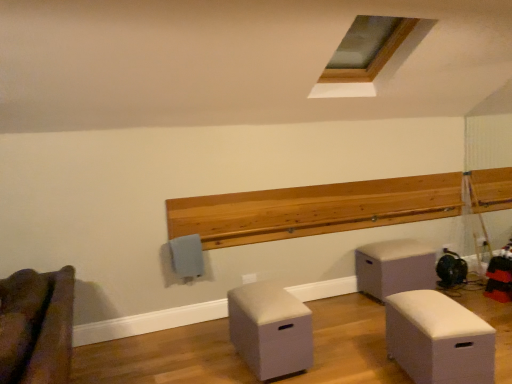
The width and height of the screenshot is (512, 384). What are the coordinates of `beige fabric ottoman at center, which ranks as the third furniture in right-to-left order` in the screenshot? It's located at (270, 330).

The height and width of the screenshot is (384, 512). Find the location of `wooden ledge at upper center`. wooden ledge at upper center is located at coordinates (335, 207).

Image resolution: width=512 pixels, height=384 pixels. Describe the element at coordinates (394, 267) in the screenshot. I see `matte gray ottoman at center right, which is the first furniture from right to left` at that location.

Identify the location of beige fabric ottoman at center, which is the 2th furniture from left to right. The image size is (512, 384). coord(270,330).

From the image's perspective, between white matte storage box at lower right, arranged as the third furniture when viewed from the left, and brown fabric couch at lower left, which appears as the 4th furniture when viewed from the right, which one is located above?

From the image's view, white matte storage box at lower right, arranged as the third furniture when viewed from the left, is above.

From a real-world perspective, who is located higher, white matte storage box at lower right, acting as the second furniture starting from the right, or brown fabric couch at lower left, which appears as the 4th furniture when viewed from the right?

brown fabric couch at lower left, which appears as the 4th furniture when viewed from the right, is physically above.

Is white matte storage box at lower right, arranged as the third furniture when viewed from the left, to the left or to the right of brown fabric couch at lower left, the first furniture when ordered from left to right, in the image?

white matte storage box at lower right, arranged as the third furniture when viewed from the left, is to the right of brown fabric couch at lower left, the first furniture when ordered from left to right.

Which is in front, white matte storage box at lower right, acting as the second furniture starting from the right, or brown fabric couch at lower left, the first furniture when ordered from left to right?

brown fabric couch at lower left, the first furniture when ordered from left to right.

Measure the distance from wooden ledge at upper center to brown fabric couch at lower left, the first furniture when ordered from left to right.

The distance of wooden ledge at upper center from brown fabric couch at lower left, the first furniture when ordered from left to right, is 6.83 feet.

Is wooden ledge at upper center facing towards brown fabric couch at lower left, which appears as the 4th furniture when viewed from the right?

No, wooden ledge at upper center does not turn towards brown fabric couch at lower left, which appears as the 4th furniture when viewed from the right.

Considering the relative sizes of wooden ledge at upper center and brown fabric couch at lower left, which appears as the 4th furniture when viewed from the right, in the image provided, is wooden ledge at upper center taller than brown fabric couch at lower left, which appears as the 4th furniture when viewed from the right,?

In fact, wooden ledge at upper center may be shorter than brown fabric couch at lower left, which appears as the 4th furniture when viewed from the right.

Can you see wooden ledge at upper center touching brown fabric couch at lower left, which appears as the 4th furniture when viewed from the right?

They are not placed beside each other.

Considering the relative positions of beige fabric ottoman at center, which ranks as the third furniture in right-to-left order, and white matte storage box at lower right, arranged as the third furniture when viewed from the left, in the image provided, is beige fabric ottoman at center, which ranks as the third furniture in right-to-left order, in front of white matte storage box at lower right, arranged as the third furniture when viewed from the left,?

No, beige fabric ottoman at center, which ranks as the third furniture in right-to-left order, is behind white matte storage box at lower right, arranged as the third furniture when viewed from the left.

Is beige fabric ottoman at center, which is the 2th furniture from left to right, to the left or to the right of white matte storage box at lower right, arranged as the third furniture when viewed from the left, in the image?

Based on their positions, beige fabric ottoman at center, which is the 2th furniture from left to right, is located to the left of white matte storage box at lower right, arranged as the third furniture when viewed from the left.

Locate an element on the screen. The width and height of the screenshot is (512, 384). the 1st furniture positioned above the beige fabric ottoman at center, which is the 2th furniture from left to right (from the image's perspective) is located at coordinates (438, 339).

Consider the image. Is beige fabric ottoman at center, which ranks as the third furniture in right-to-left order, not within white matte storage box at lower right, arranged as the third furniture when viewed from the left?

Yes, beige fabric ottoman at center, which ranks as the third furniture in right-to-left order, is not within white matte storage box at lower right, arranged as the third furniture when viewed from the left.

How far apart are matte gray ottoman at center right, the 4th furniture positioned from the left, and brown fabric couch at lower left, which appears as the 4th furniture when viewed from the right?

A distance of 2.99 meters exists between matte gray ottoman at center right, the 4th furniture positioned from the left, and brown fabric couch at lower left, which appears as the 4th furniture when viewed from the right.

Does matte gray ottoman at center right, which is the first furniture from right to left, appear on the left side of brown fabric couch at lower left, the first furniture when ordered from left to right?

No.

From the image's perspective, is matte gray ottoman at center right, the 4th furniture positioned from the left, on brown fabric couch at lower left, the first furniture when ordered from left to right?

Yes, from the image's perspective, matte gray ottoman at center right, the 4th furniture positioned from the left, is above brown fabric couch at lower left, the first furniture when ordered from left to right.

From a real-world perspective, between matte gray ottoman at center right, the 4th furniture positioned from the left, and brown fabric couch at lower left, the first furniture when ordered from left to right, who is vertically higher?

brown fabric couch at lower left, the first furniture when ordered from left to right, is physically above.

From a real-world perspective, which is physically above, matte gray ottoman at center right, which is the first furniture from right to left, or wooden ledge at upper center?

wooden ledge at upper center, from a real-world perspective.

Is matte gray ottoman at center right, the 4th furniture positioned from the left, looking in the opposite direction of wooden ledge at upper center?

No, wooden ledge at upper center is not at the back of matte gray ottoman at center right, the 4th furniture positioned from the left.

Is matte gray ottoman at center right, the 4th furniture positioned from the left, wider or thinner than wooden ledge at upper center?

In the image, matte gray ottoman at center right, the 4th furniture positioned from the left, appears to be wider than wooden ledge at upper center.

Can you confirm if matte gray ottoman at center right, which is the first furniture from right to left, is positioned to the left of wooden ledge at upper center?

No.

From a real-world perspective, who is located higher, clear glass window at upper center or beige fabric ottoman at center, which ranks as the third furniture in right-to-left order?

In real-world perspective, clear glass window at upper center is above.

Is clear glass window at upper center further to camera compared to beige fabric ottoman at center, which ranks as the third furniture in right-to-left order?

Yes, the depth of clear glass window at upper center is greater than that of beige fabric ottoman at center, which ranks as the third furniture in right-to-left order.

Is there a large distance between clear glass window at upper center and beige fabric ottoman at center, which ranks as the third furniture in right-to-left order?

Yes, clear glass window at upper center and beige fabric ottoman at center, which ranks as the third furniture in right-to-left order, are located far from each other.

The image size is (512, 384). What are the coordinates of `window above the beige fabric ottoman at center, which ranks as the third furniture in right-to-left order (from the image's perspective)` in the screenshot? It's located at (367, 48).

Is wooden ledge at upper center in front of or behind beige fabric ottoman at center, which ranks as the third furniture in right-to-left order, in the image?

wooden ledge at upper center is behind beige fabric ottoman at center, which ranks as the third furniture in right-to-left order.

From a real-world perspective, is wooden ledge at upper center above or below beige fabric ottoman at center, which is the 2th furniture from left to right?

In terms of real-world spatial position, wooden ledge at upper center is above beige fabric ottoman at center, which is the 2th furniture from left to right.

Is point (326, 230) closer or farther from the camera than point (300, 346)?

Point (326, 230) is farther from the camera than point (300, 346).

Looking at the image, does wooden ledge at upper center seem bigger or smaller compared to beige fabric ottoman at center, which is the 2th furniture from left to right?

Considering their sizes, wooden ledge at upper center takes up more space than beige fabric ottoman at center, which is the 2th furniture from left to right.

This screenshot has height=384, width=512. In order to click on the 2nd furniture counting from the left of the white matte storage box at lower right, arranged as the third furniture when viewed from the left in this screenshot , I will do `click(36, 326)`.

In the image, there is a brown fabric couch at lower left, which appears as the 4th furniture when viewed from the right. At what (x,y) coordinates should I click in order to perform the action: click on ledge above it (from the image's perspective). Please return your answer as a coordinate pair (x, y). Looking at the image, I should click on (335, 207).

Which object lies nearer to the anchor point wooden ledge at upper center, beige fabric ottoman at center, which is the 2th furniture from left to right, or white matte storage box at lower right, acting as the second furniture starting from the right?

beige fabric ottoman at center, which is the 2th furniture from left to right.

When comparing their distances from beige fabric ottoman at center, which ranks as the third furniture in right-to-left order, does clear glass window at upper center or white matte storage box at lower right, acting as the second furniture starting from the right, seem closer?

Based on the image, white matte storage box at lower right, acting as the second furniture starting from the right, appears to be nearer to beige fabric ottoman at center, which ranks as the third furniture in right-to-left order.

In the scene shown: Looking at the image, which one is located closer to clear glass window at upper center, white matte storage box at lower right, acting as the second furniture starting from the right, or beige fabric ottoman at center, which ranks as the third furniture in right-to-left order?

beige fabric ottoman at center, which ranks as the third furniture in right-to-left order.

Estimate the real-world distances between objects in this image. Which object is closer to beige fabric ottoman at center, which is the 2th furniture from left to right, clear glass window at upper center or brown fabric couch at lower left, the first furniture when ordered from left to right?

brown fabric couch at lower left, the first furniture when ordered from left to right.

Based on their spatial positions, is wooden ledge at upper center or clear glass window at upper center closer to white matte storage box at lower right, acting as the second furniture starting from the right?

wooden ledge at upper center lies closer to white matte storage box at lower right, acting as the second furniture starting from the right, than the other object.

When comparing their distances from matte gray ottoman at center right, which is the first furniture from right to left, does white matte storage box at lower right, acting as the second furniture starting from the right, or wooden ledge at upper center seem closer?

Based on the image, wooden ledge at upper center appears to be nearer to matte gray ottoman at center right, which is the first furniture from right to left.

From the image, which object appears to be farther from white matte storage box at lower right, arranged as the third furniture when viewed from the left, clear glass window at upper center or beige fabric ottoman at center, which ranks as the third furniture in right-to-left order?

clear glass window at upper center lies further to white matte storage box at lower right, arranged as the third furniture when viewed from the left, than the other object.

From the image, which object appears to be nearer to matte gray ottoman at center right, which is the first furniture from right to left, wooden ledge at upper center or clear glass window at upper center?

Among the two, wooden ledge at upper center is located nearer to matte gray ottoman at center right, which is the first furniture from right to left.

Find the location of `window between brown fabric couch at lower left, which appears as the 4th furniture when viewed from the right, and white matte storage box at lower right, acting as the second furniture starting from the right`. window between brown fabric couch at lower left, which appears as the 4th furniture when viewed from the right, and white matte storage box at lower right, acting as the second furniture starting from the right is located at coordinates (367, 48).

Locate an element on the screen. The height and width of the screenshot is (384, 512). furniture between brown fabric couch at lower left, which appears as the 4th furniture when viewed from the right, and white matte storage box at lower right, acting as the second furniture starting from the right, from left to right is located at coordinates (270, 330).

At what (x,y) coordinates should I click in order to perform the action: click on furniture between white matte storage box at lower right, arranged as the third furniture when viewed from the left, and matte gray ottoman at center right, which is the first furniture from right to left, in the front-back direction. Please return your answer as a coordinate pair (x, y). Looking at the image, I should click on (270, 330).

Locate an element on the screen. ledge located between white matte storage box at lower right, arranged as the third furniture when viewed from the left, and matte gray ottoman at center right, which is the first furniture from right to left, in the depth direction is located at coordinates (335, 207).